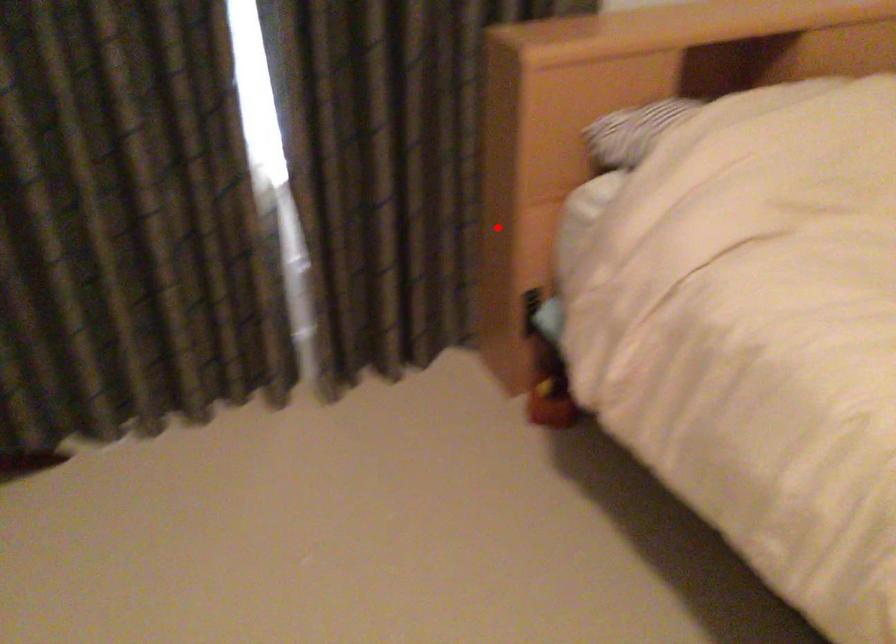
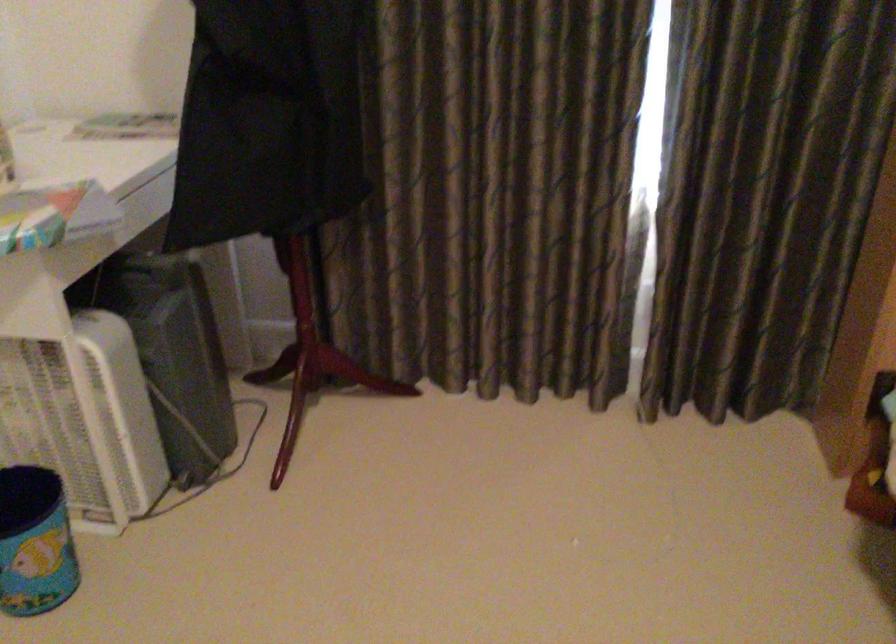
Locate, in the second image, the point that corresponds to the highlighted location in the first image.

(865, 298)